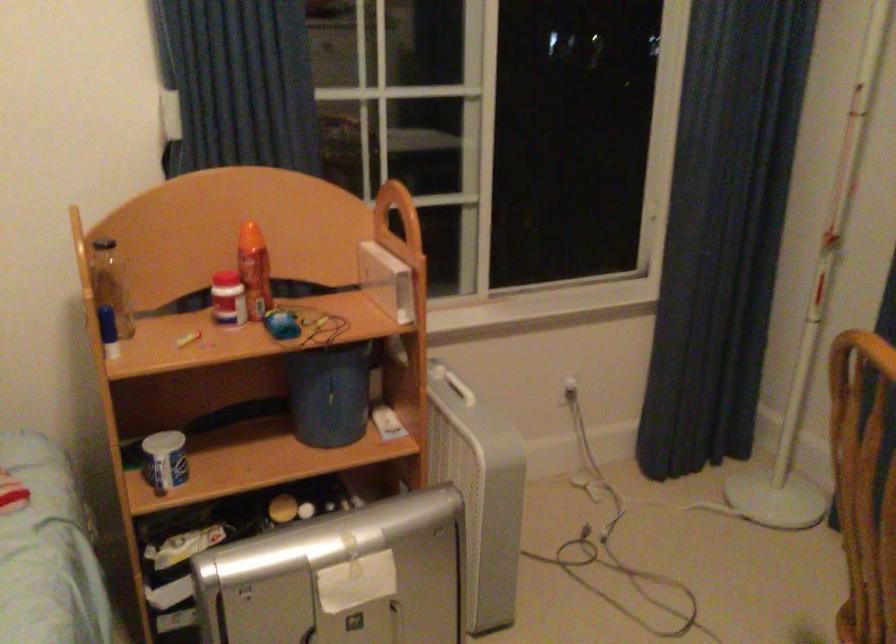
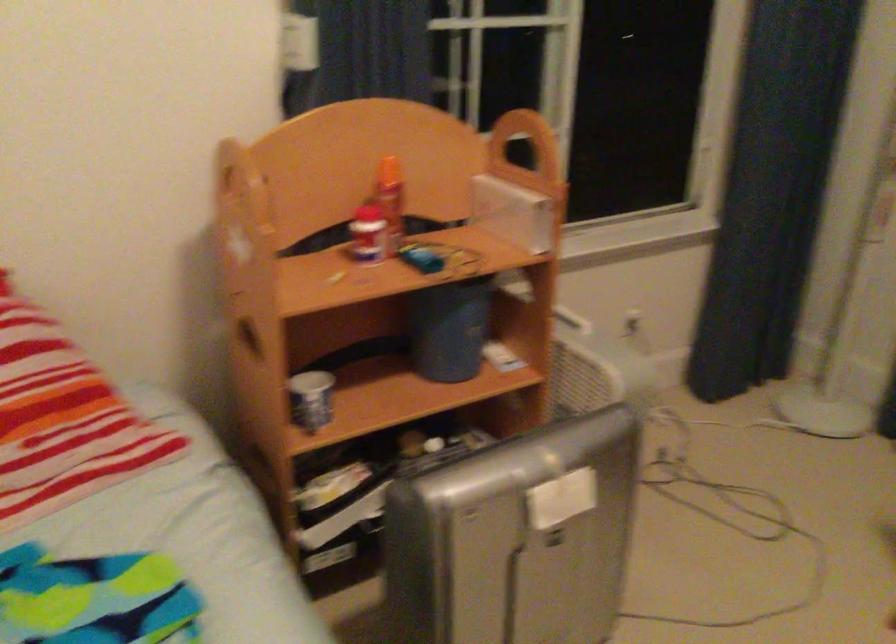
Where in the second image is the point corresponding to the point at 231,299 from the first image?

(367, 234)